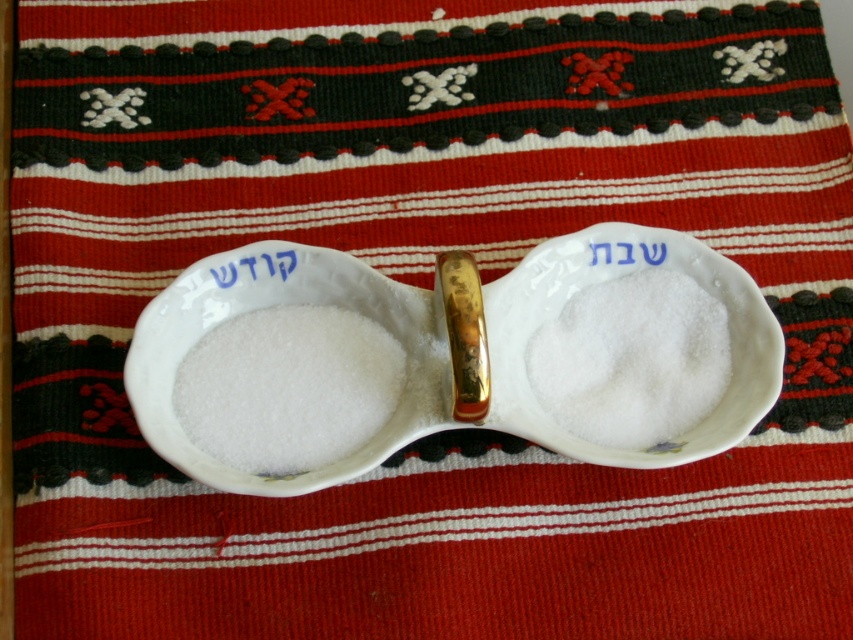
Question: Considering the real-world distances, which object is closest to the white ceramic bowl at center?

Choices:
 (A) white powder at center
 (B) white powdery flour at center
 (C) white ceramic text at center
 (D) white paper at center

Answer: (B)

Question: Can you confirm if white ceramic text at center is positioned above white paper at center?

Choices:
 (A) no
 (B) yes

Answer: (A)

Question: Does white ceramic bowl at center appear under white powder at center?

Choices:
 (A) no
 (B) yes

Answer: (A)

Question: Which is farther from the white powder at center?

Choices:
 (A) white ceramic text at center
 (B) white ceramic bowl at center
 (C) white paper at center
 (D) white powdery flour at center

Answer: (A)

Question: Does white powdery flour at center have a larger size compared to white powder at center?

Choices:
 (A) no
 (B) yes

Answer: (B)

Question: Which of the following is the closest to the observer?

Choices:
 (A) (637, 252)
 (B) (258, 362)
 (C) (229, 266)

Answer: (C)